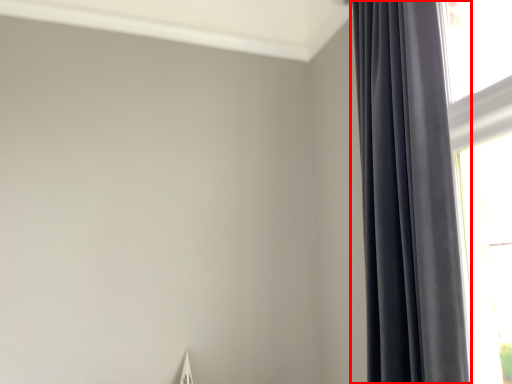
Question: Observing the image, what is the correct spatial positioning of curtain (annotated by the red box) in reference to window?

Choices:
 (A) left
 (B) right

Answer: (A)